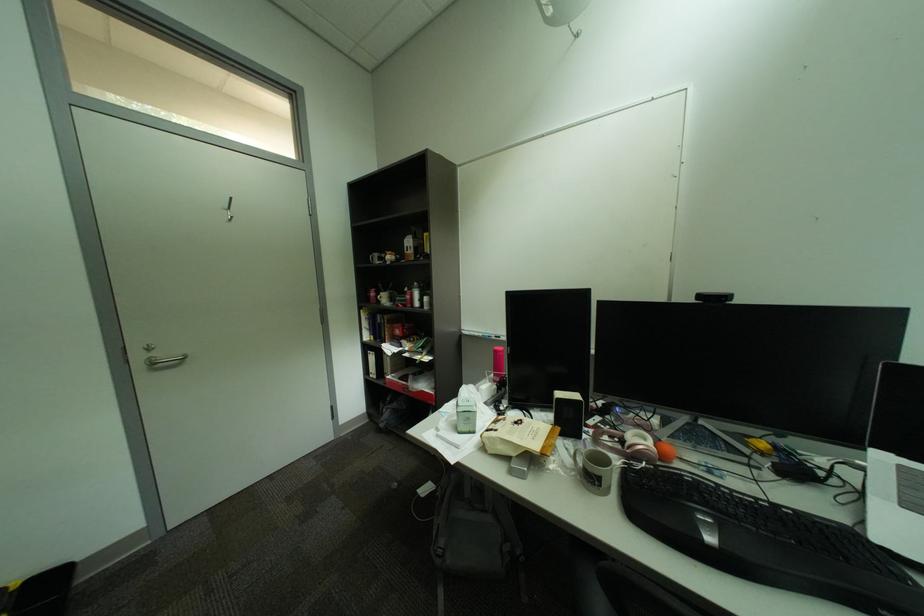
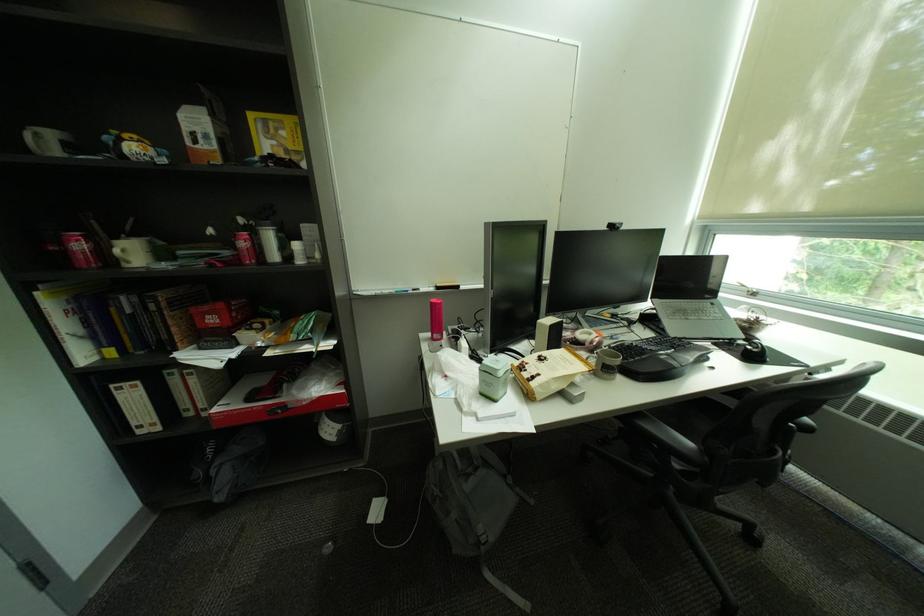
Locate, in the second image, the point that corresponds to (453,490) in the first image.

(446, 487)